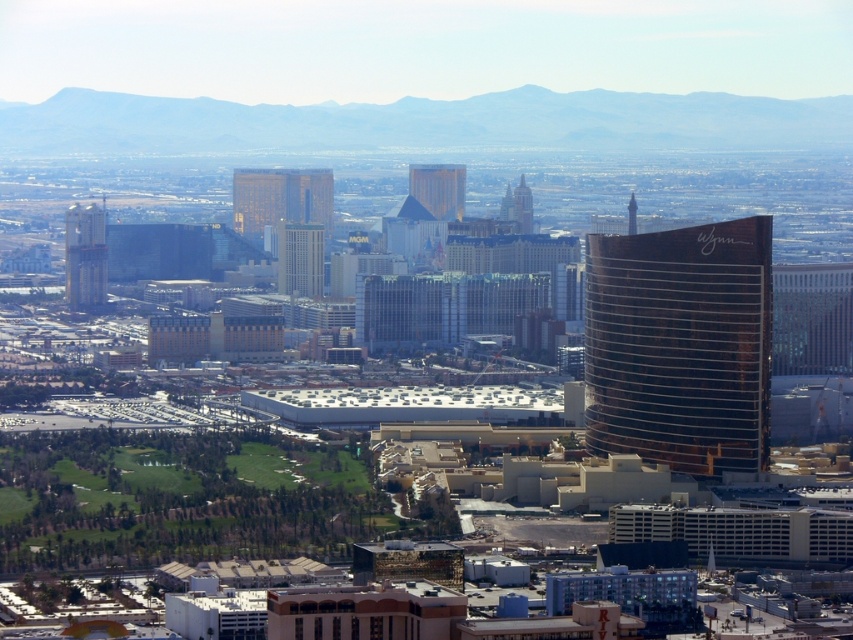
Between glassy reflective skyscraper at center and gold glass tower at center, which one has more height?

With more height is glassy reflective skyscraper at center.

Can you confirm if glassy reflective skyscraper at center is thinner than gold glass tower at center?

Incorrect, glassy reflective skyscraper at center's width is not less than gold glass tower at center's.

Does point (277, 272) come closer to viewer compared to point (523, 193)?

Yes.

I want to click on glassy reflective skyscraper at center, so click(300, 259).

Between gold reflective tower at left and shiny brown tower at upper right, which one appears on the left side from the viewer's perspective?

gold reflective tower at left is more to the left.

Looking at this image, who is positioned more to the right, gold reflective tower at left or shiny brown tower at upper right?

shiny brown tower at upper right

Does point (94, 212) come in front of point (631, 205)?

No, it is not.

Image resolution: width=853 pixels, height=640 pixels. In order to click on gold reflective tower at left in this screenshot , I will do `click(85, 257)`.

Can you confirm if gold reflective glass building at center is positioned to the right of gold glass tower at center?

No, gold reflective glass building at center is not to the right of gold glass tower at center.

Locate an element on the screen. This screenshot has height=640, width=853. gold reflective glass building at center is located at coordinates (281, 198).

Identify the location of gold reflective glass building at center. The image size is (853, 640). (281, 198).